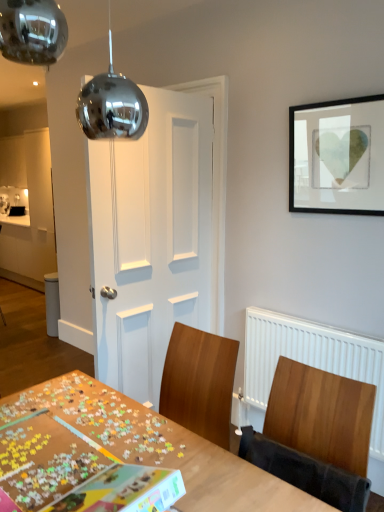
Question: Could wooden puzzle board at center be considered to be inside white matte door at center?

Choices:
 (A) no
 (B) yes

Answer: (A)

Question: Is white matte door at center positioned beyond the bounds of wooden puzzle board at center?

Choices:
 (A) yes
 (B) no

Answer: (A)

Question: Is white matte door at center to the left of wooden puzzle board at center from the viewer's perspective?

Choices:
 (A) yes
 (B) no

Answer: (B)

Question: Is white matte door at center thinner than wooden puzzle board at center?

Choices:
 (A) yes
 (B) no

Answer: (A)

Question: Does white matte door at center have a lesser height compared to wooden puzzle board at center?

Choices:
 (A) no
 (B) yes

Answer: (A)

Question: Does white matte door at center appear on the right side of wooden puzzle board at center?

Choices:
 (A) no
 (B) yes

Answer: (B)

Question: Is wooden chair at right behind black matte picture frame at upper right?

Choices:
 (A) no
 (B) yes

Answer: (A)

Question: Is black matte picture frame at upper right a part of wooden chair at right?

Choices:
 (A) yes
 (B) no

Answer: (B)

Question: Are wooden chair at right and black matte picture frame at upper right making contact?

Choices:
 (A) yes
 (B) no

Answer: (B)

Question: Does wooden chair at right have a smaller size compared to black matte picture frame at upper right?

Choices:
 (A) no
 (B) yes

Answer: (A)

Question: From a real-world perspective, does wooden chair at right stand above black matte picture frame at upper right?

Choices:
 (A) yes
 (B) no

Answer: (B)

Question: Is wooden chair at right oriented towards black matte picture frame at upper right?

Choices:
 (A) no
 (B) yes

Answer: (A)

Question: Is wooden puzzle board at center far from wooden chair at right?

Choices:
 (A) no
 (B) yes

Answer: (A)